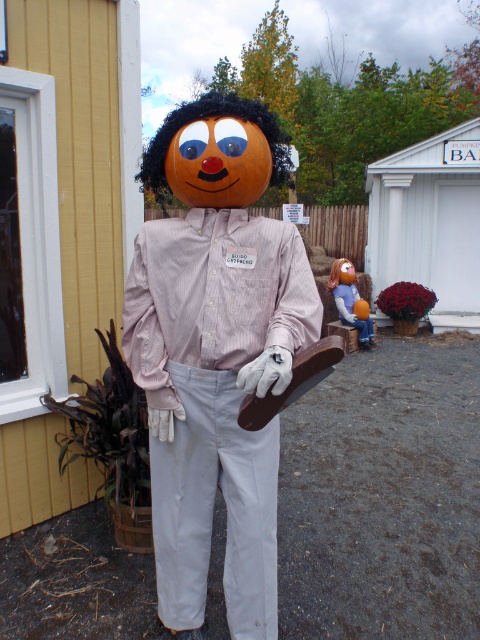
Who is lower down, pink striped shirt at center or orange matte pumpkin at center?

pink striped shirt at center

At what (x,y) coordinates should I click in order to perform the action: click on pink striped shirt at center. Please return your answer as a coordinate pair (x, y). Looking at the image, I should click on (215, 397).